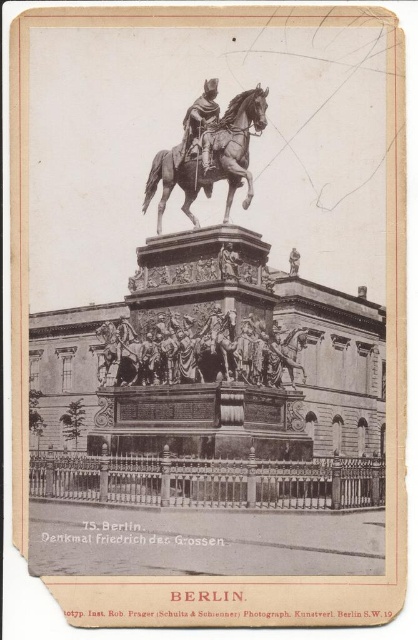
Is point (231, 132) closer to viewer compared to point (188, 124)?

That is True.

Measure the distance between polished bronze horse at center and bronze statue at center.

A distance of 3.61 meters exists between polished bronze horse at center and bronze statue at center.

Between point (262, 88) and point (193, 134), which one is positioned behind?

Point (193, 134)

The width and height of the screenshot is (418, 640). Find the location of `polished bronze horse at center`. polished bronze horse at center is located at coordinates (209, 150).